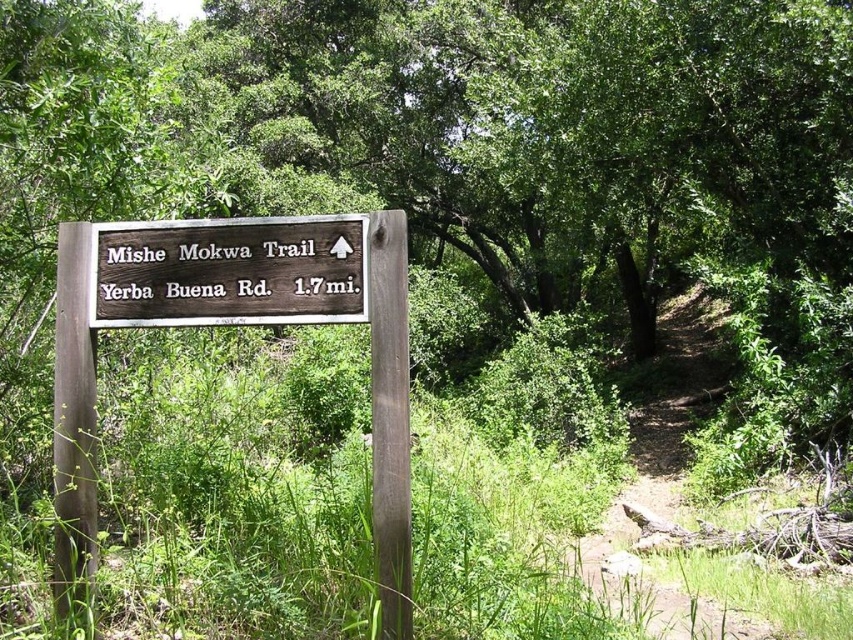
Which is behind, point (399, 284) or point (136, 292)?

The point (136, 292) is behind.

Who is higher up, wooden sign at center or brown wooden sign at center?

Positioned higher is brown wooden sign at center.

Is point (57, 589) behind point (294, 280)?

No, it is in front of (294, 280).

Where is `wooden sign at center`? The image size is (853, 640). wooden sign at center is located at coordinates (234, 324).

In the scene shown: Does wooden sign at center have a lesser height compared to dirt path at center?

Correct, wooden sign at center is not as tall as dirt path at center.

Which is in front, point (372, 412) or point (654, 582)?

Point (372, 412)

Where is `wooden sign at center`? Image resolution: width=853 pixels, height=640 pixels. wooden sign at center is located at coordinates (234, 324).

Can you confirm if brown wooden sign at center is wider than dirt path at center?

Incorrect, brown wooden sign at center's width does not surpass dirt path at center's.

In the scene shown: Can you confirm if brown wooden sign at center is smaller than dirt path at center?

Yes.

Which is in front, point (283, 256) or point (682, 385)?

Point (283, 256)

Image resolution: width=853 pixels, height=640 pixels. Identify the location of brown wooden sign at center. (229, 272).